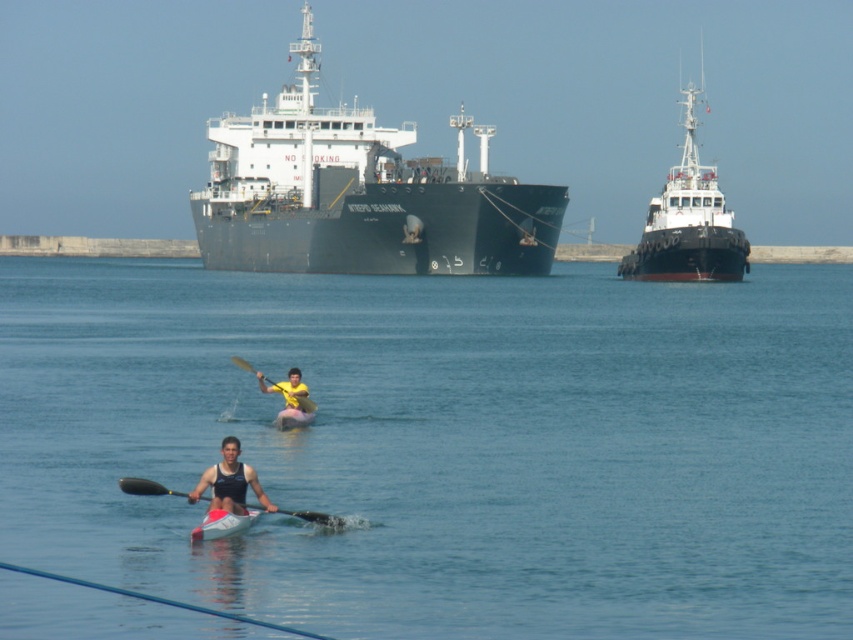
Which is behind, point (227, 518) or point (288, 426)?

Positioned behind is point (288, 426).

Is white plastic canoe at center to the right of pink rubber kayak at center from the viewer's perspective?

No, white plastic canoe at center is not to the right of pink rubber kayak at center.

Is point (225, 513) behind point (289, 410)?

No, (225, 513) is closer to viewer.

Find the location of a particular element. The image size is (853, 640). white plastic canoe at center is located at coordinates tap(224, 524).

Does yellow fabric kayak at center have a lesser height compared to yellow matte paddle at center?

Correct, yellow fabric kayak at center is not as tall as yellow matte paddle at center.

Is yellow fabric kayak at center wider than yellow matte paddle at center?

No, yellow fabric kayak at center is not wider than yellow matte paddle at center.

Between point (312, 416) and point (247, 360), which one is positioned behind?

The point (247, 360) is more distant.

Where is `yellow fabric kayak at center`? This screenshot has width=853, height=640. yellow fabric kayak at center is located at coordinates (289, 400).

How distant is black matte tugboat at upper right from matte black kayak at center?

black matte tugboat at upper right and matte black kayak at center are 289.29 feet apart.

Does black matte tugboat at upper right appear under matte black kayak at center?

No.

This screenshot has width=853, height=640. I want to click on black matte tugboat at upper right, so click(x=688, y=220).

Image resolution: width=853 pixels, height=640 pixels. I want to click on black matte tugboat at upper right, so click(688, 220).